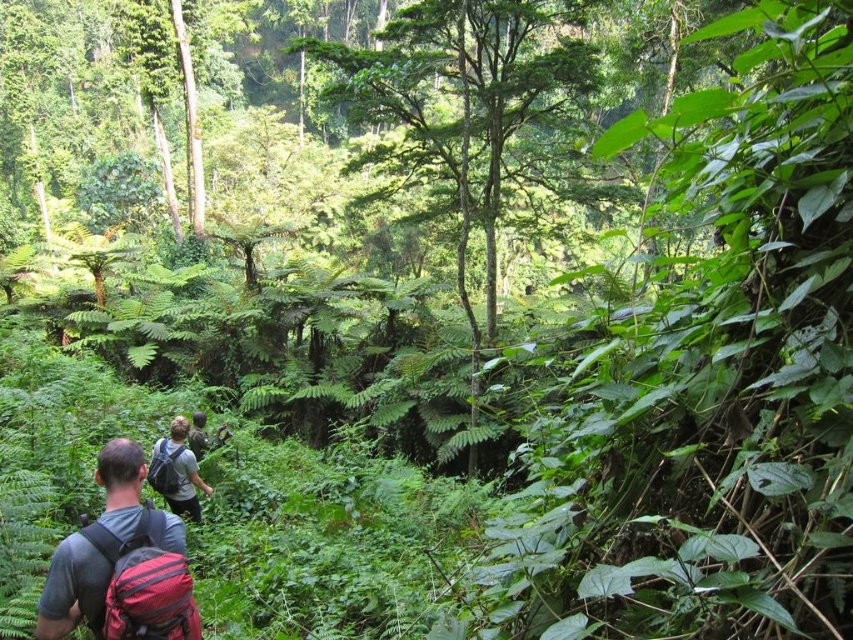
Question: Does red fabric backpack at lower left appear over matte gray backpack at center?

Choices:
 (A) no
 (B) yes

Answer: (B)

Question: Considering the real-world distances, which object is closest to the matte gray backpack at center?

Choices:
 (A) matte red backpack at lower left
 (B) red fabric backpack at lower left

Answer: (A)

Question: Among these objects, which one is farthest from the camera?

Choices:
 (A) matte red backpack at lower left
 (B) matte gray backpack at center

Answer: (B)

Question: Observing the image, what is the correct spatial positioning of red fabric backpack at lower left in reference to matte red backpack at lower left?

Choices:
 (A) above
 (B) below

Answer: (A)

Question: Which is farther from the red backpack at lower left?

Choices:
 (A) red fabric backpack at lower left
 (B) matte gray backpack at center

Answer: (B)

Question: Can you confirm if matte gray backpack at center is thinner than red backpack at lower left?

Choices:
 (A) yes
 (B) no

Answer: (B)